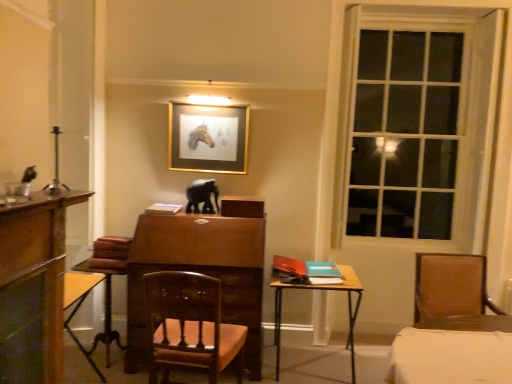
The image size is (512, 384). What are the coordinates of `vacant area situated below wooden table at center, which ranks as the 2th table in left-to-right order (from a real-world perspective)` in the screenshot? It's located at (309, 370).